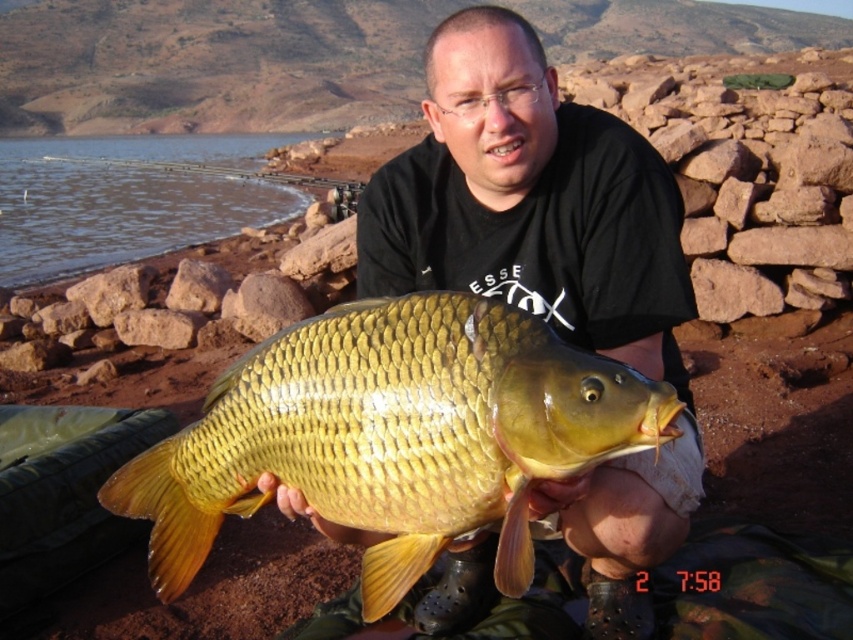
You are a wildlife photographer trying to capture a clear photo of the matte gold fish at center and the brown smooth water at upper left. Your camera has a maximum focus range of 12 meters. Will you be able to focus on both subjects simultaneously?

The matte gold fish at center is 12.76 meters away from the brown smooth water at upper left. Since the distance between them exceeds the camera maximum focus range of 12 meters, you won

You are a fisherman who just caught two types of gold fish. The matte gold fish at center and the shiny gold fish at center. You need to decide which one is easier to handle based on their body thickness. According to the scene description, which fish would be easier to grip without slipping?

The matte gold fish at center is thinner than the shiny gold fish at center, so the matte gold fish at center would be easier to grip without slipping because its thinner body requires less force to hold securely.